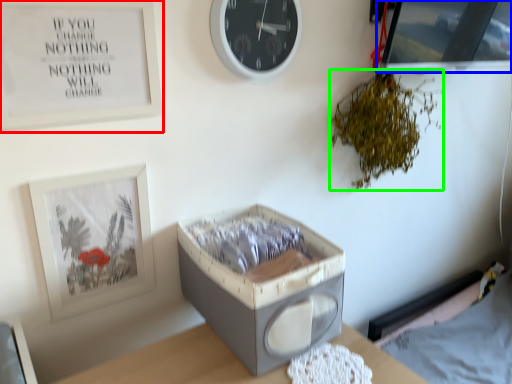
Question: Based on their relative distances, which object is farther from picture frame (highlighted by a red box)? Choose from picture frame (highlighted by a blue box) and plant (highlighted by a green box).

Choices:
 (A) picture frame
 (B) plant

Answer: (A)